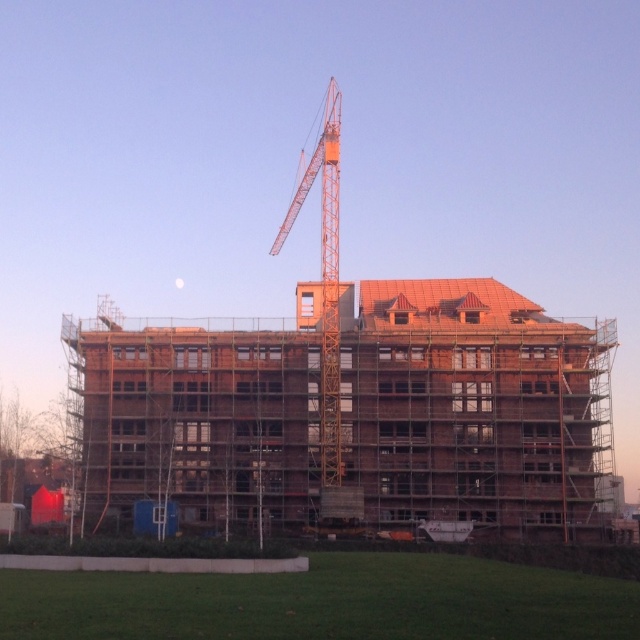
Question: Is brown wooden building at center wider than orange metallic crane at center?

Choices:
 (A) yes
 (B) no

Answer: (A)

Question: Which point appears farthest from the camera in this image?

Choices:
 (A) (321, 253)
 (B) (241, 410)

Answer: (A)

Question: Is brown wooden building at center smaller than orange metallic crane at center?

Choices:
 (A) yes
 (B) no

Answer: (B)

Question: Which of the following is the closest to the observer?

Choices:
 (A) (198, 516)
 (B) (326, 147)

Answer: (A)

Question: Does brown wooden building at center appear under orange metallic crane at center?

Choices:
 (A) yes
 (B) no

Answer: (A)